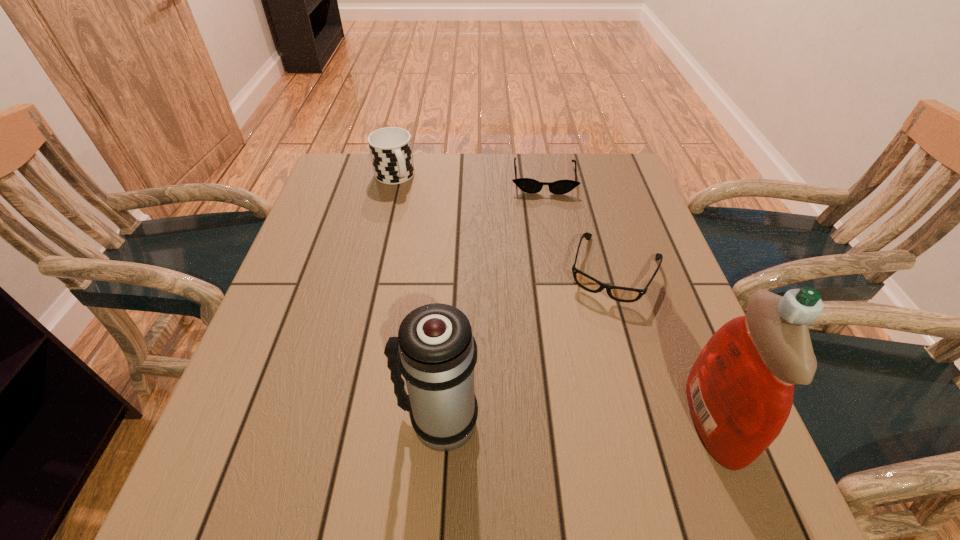
Locate an element on the screen. vacant area at the left edge of the desktop is located at coordinates (324, 248).

Where is `vacant region at the right edge`? This screenshot has width=960, height=540. vacant region at the right edge is located at coordinates (665, 263).

Where is `vacant space at the far right corner`? The height and width of the screenshot is (540, 960). vacant space at the far right corner is located at coordinates (629, 191).

At what (x,y) coordinates should I click in order to perform the action: click on empty space between the shortest object and the third farthest object. Please return your answer as a coordinate pair (x, y). This screenshot has width=960, height=540. Looking at the image, I should click on (579, 224).

Where is `vacant area that lies between the third nearest object and the detergent`? vacant area that lies between the third nearest object and the detergent is located at coordinates (663, 345).

The height and width of the screenshot is (540, 960). What are the coordinates of `free point between the third farthest object and the fourth object from right to left` in the screenshot? It's located at (527, 346).

Locate an element on the screen. The width and height of the screenshot is (960, 540). empty space between the thermos bottle and the detergent is located at coordinates (576, 421).

The image size is (960, 540). Identify the location of vacant area that lies between the spectacles and the cup. (504, 224).

This screenshot has height=540, width=960. What are the coordinates of `free spot between the fourth object from right to left and the detergent` in the screenshot? It's located at click(576, 421).

The width and height of the screenshot is (960, 540). In order to click on free space between the sunglasses and the third farthest object in this screenshot , I will do coord(579,224).